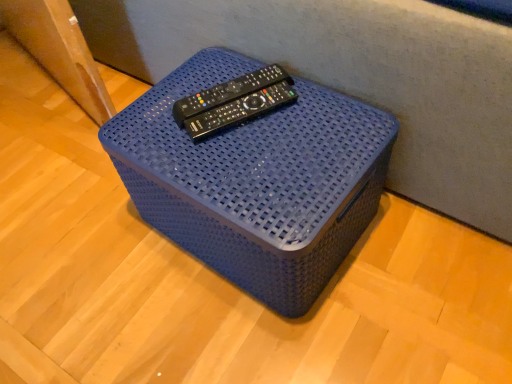
Identify the location of unoccupied space behind black plastic remote at center. (224, 65).